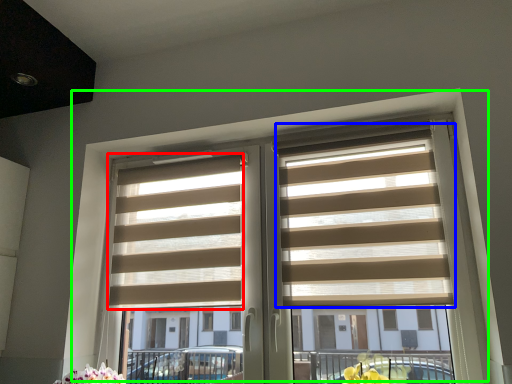
Question: Which is farther away from blind (highlighted by a red box)? blind (highlighted by a blue box) or window (highlighted by a green box)?

Choices:
 (A) blind
 (B) window

Answer: (A)